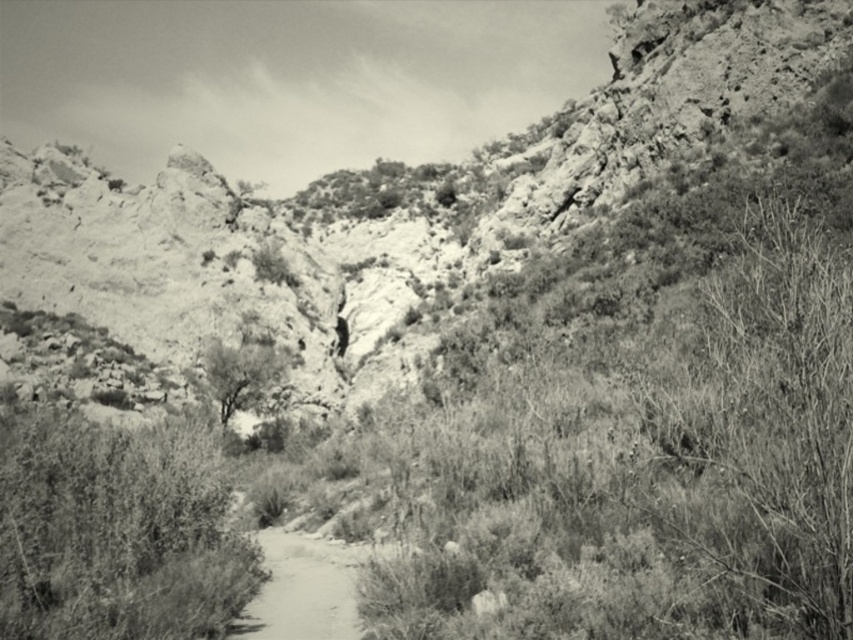
Question: Which point appears closest to the camera in this image?

Choices:
 (A) (219, 595)
 (B) (218, 371)
 (C) (215, 252)
 (D) (762, 621)

Answer: (D)

Question: Does rugged stone mountain at center appear under thick green bush at center?

Choices:
 (A) no
 (B) yes

Answer: (A)

Question: Can you confirm if thick green bush at center is positioned to the left of grainy gray tree at center?

Choices:
 (A) yes
 (B) no

Answer: (A)

Question: Is rugged stone mountain at center to the right of smooth dirt path at center from the viewer's perspective?

Choices:
 (A) yes
 (B) no

Answer: (A)

Question: Which of the following is the farthest from the observer?

Choices:
 (A) thorny bush at right
 (B) grainy gray tree at center

Answer: (B)

Question: Among these objects, which one is nearest to the camera?

Choices:
 (A) rugged stone mountain at center
 (B) grainy gray tree at center

Answer: (A)